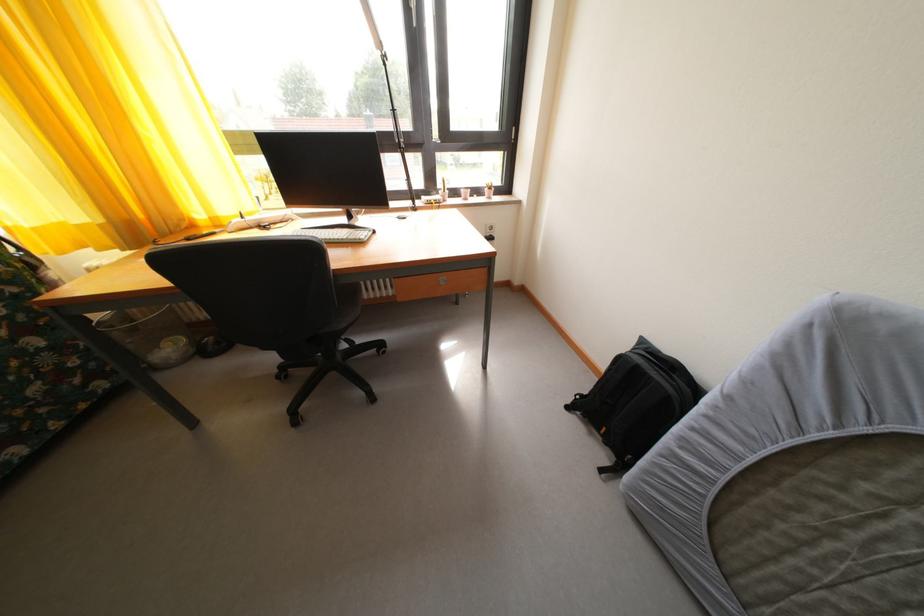
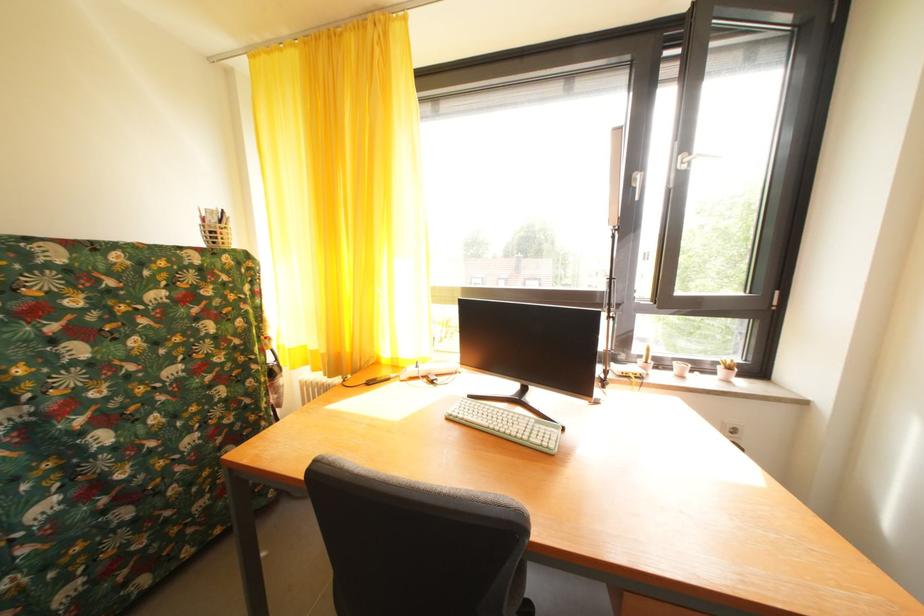
Find the pixel in the second image that matches point 494,196 in the first image.

(728, 374)